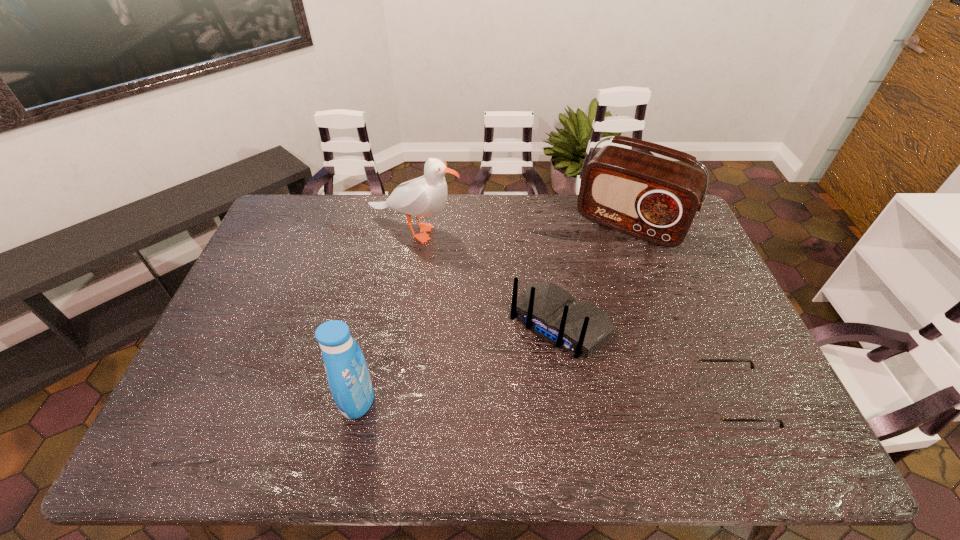
Locate an element on the screen. The image size is (960, 540). detergent is located at coordinates pyautogui.click(x=347, y=373).

You are a GUI agent. You are given a task and a screenshot of the screen. Output one action in this format:
    pyautogui.click(x=<x>, y=<y>)
    Task: Click on the spectacles
    This screenshot has width=960, height=540.
    Given the screenshot: What is the action you would take?
    pyautogui.click(x=712, y=408)

Where is `gull`? Image resolution: width=960 pixels, height=540 pixels. gull is located at coordinates (424, 196).

Image resolution: width=960 pixels, height=540 pixels. What are the coordinates of `radio receiver` in the screenshot? It's located at pyautogui.click(x=654, y=199).

Identify the location of the second shortest object. (551, 313).

Where is `router`? The width and height of the screenshot is (960, 540). router is located at coordinates (551, 313).

The width and height of the screenshot is (960, 540). What are the coordinates of `vacant space located on the front-facing side of the detergent` in the screenshot? It's located at (214, 400).

I want to click on free point located 0.190m on the front-facing side of the detergent, so click(x=266, y=400).

The height and width of the screenshot is (540, 960). In order to click on free space located 0.390m on the front-facing side of the detergent in this screenshot , I will do `click(185, 400)`.

Where is `free space located at the hinge ends of the shortest object`? free space located at the hinge ends of the shortest object is located at coordinates (638, 399).